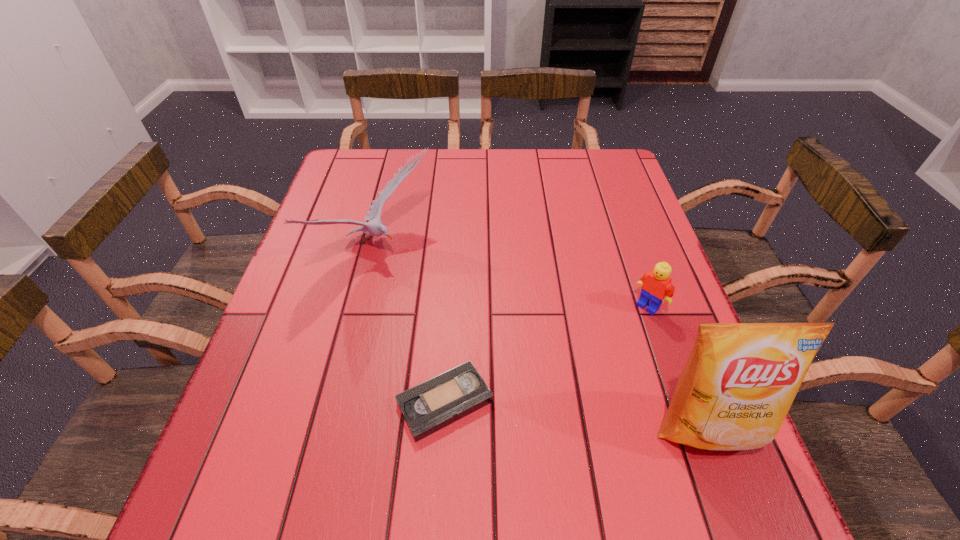
Identify the location of vacant space located on the front-facing side of the third nearest object. The width and height of the screenshot is (960, 540). (521, 435).

Identify the location of free location located 0.230m on the front-facing side of the third nearest object. (577, 379).

Image resolution: width=960 pixels, height=540 pixels. What are the coordinates of `vacant space located 0.380m on the front-facing side of the third nearest object` in the screenshot? It's located at (525, 431).

Find the location of a particular element. videotape situated at the near edge is located at coordinates (438, 402).

Locate an element on the screen. crisp (potato chip) that is at the near edge is located at coordinates (740, 380).

Locate an element on the screen. This screenshot has height=540, width=960. object present at the left edge is located at coordinates (374, 227).

Locate an element on the screen. Image resolution: width=960 pixels, height=540 pixels. crisp (potato chip) at the right edge is located at coordinates (740, 380).

The height and width of the screenshot is (540, 960). I want to click on Lego situated at the right edge, so click(655, 285).

Find the location of `object present at the near right corner`. object present at the near right corner is located at coordinates (740, 380).

Where is `free spot at the far edge of the desktop`? This screenshot has height=540, width=960. free spot at the far edge of the desktop is located at coordinates (441, 176).